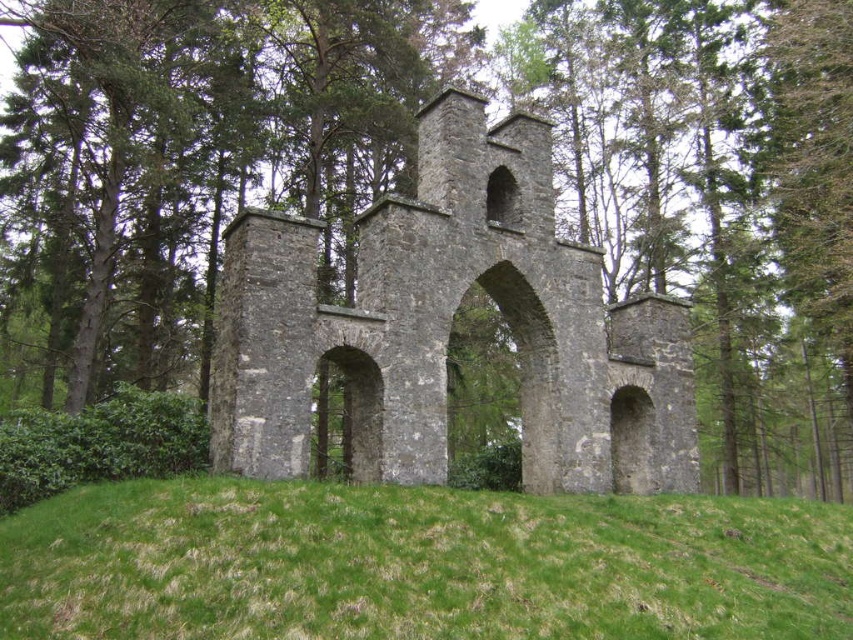
Who is positioned more to the right, green grassy hill at center or gray stone archway at center?

Positioned to the right is green grassy hill at center.

Who is more forward, (22, 509) or (444, 432)?

Point (22, 509) is more forward.

This screenshot has width=853, height=640. I want to click on green grassy hill at center, so click(x=418, y=564).